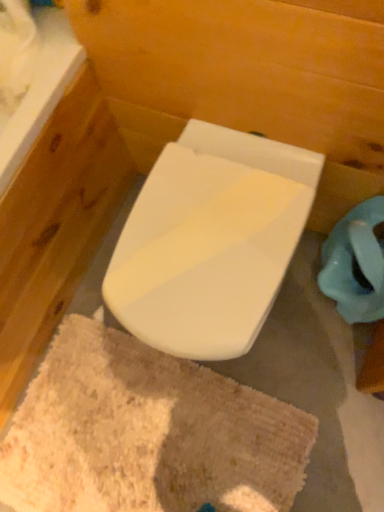
I want to click on free space above white glossy toilet at center (from a real-world perspective), so click(205, 241).